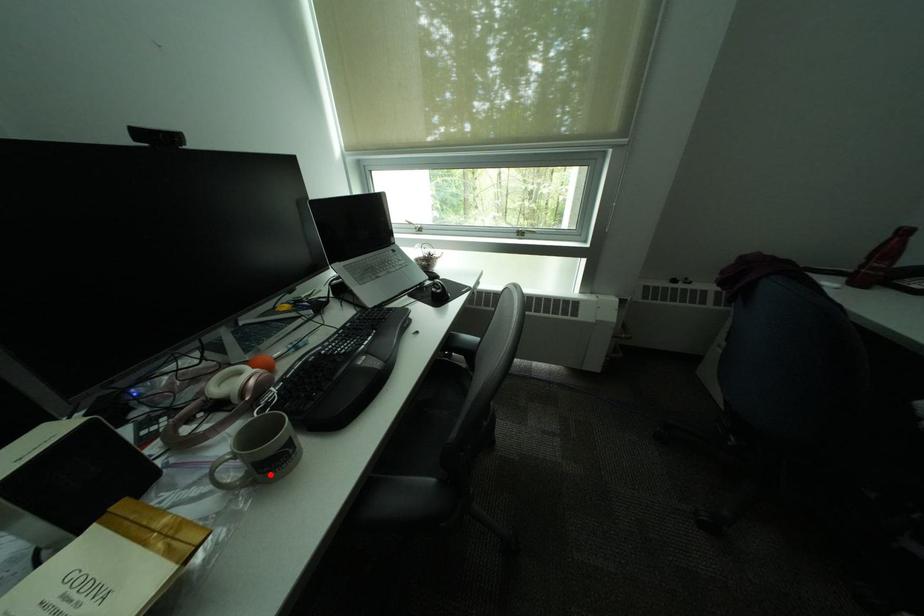
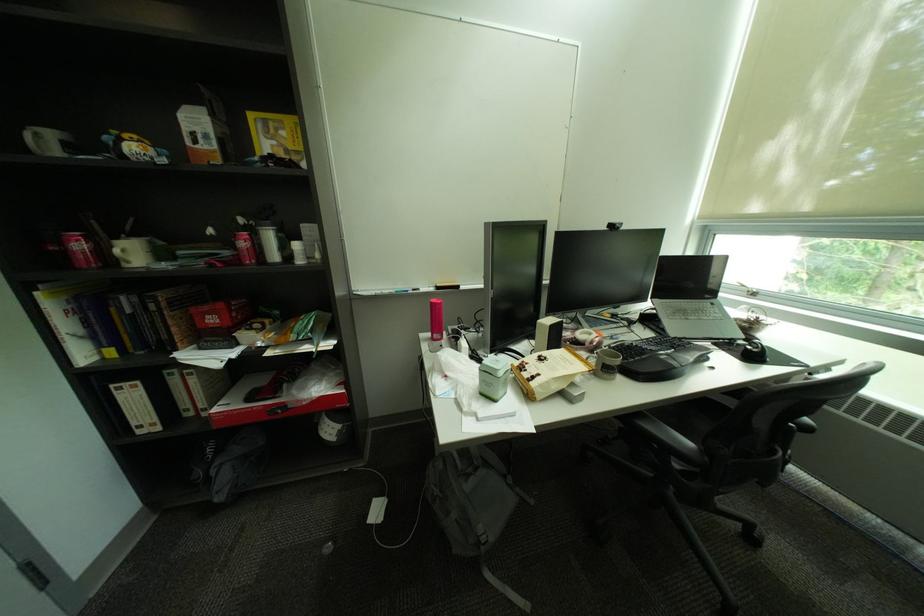
Where in the second image is the point corresponding to the highlighted location from the first image?

(613, 371)